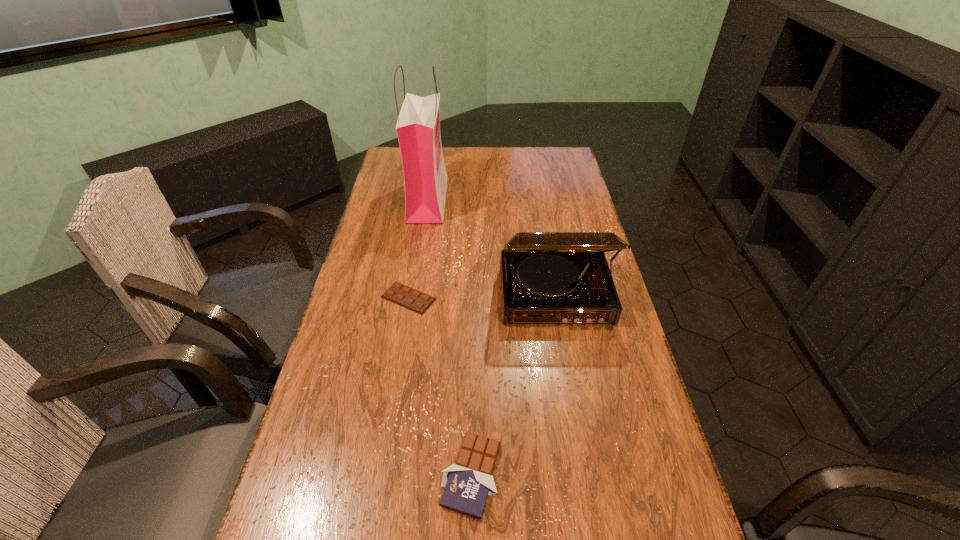
You are a GUI agent. You are given a task and a screenshot of the screen. Output one action in this format:
    pyautogui.click(x=<x>, y=<y>)
    Task: Click on the free location that satisfies the following two spatial constraints: 1. on the front-facing side of the farthest object; 2. on the right side of the nearer chocolate bar
    
    Given the screenshot: What is the action you would take?
    pyautogui.click(x=384, y=475)